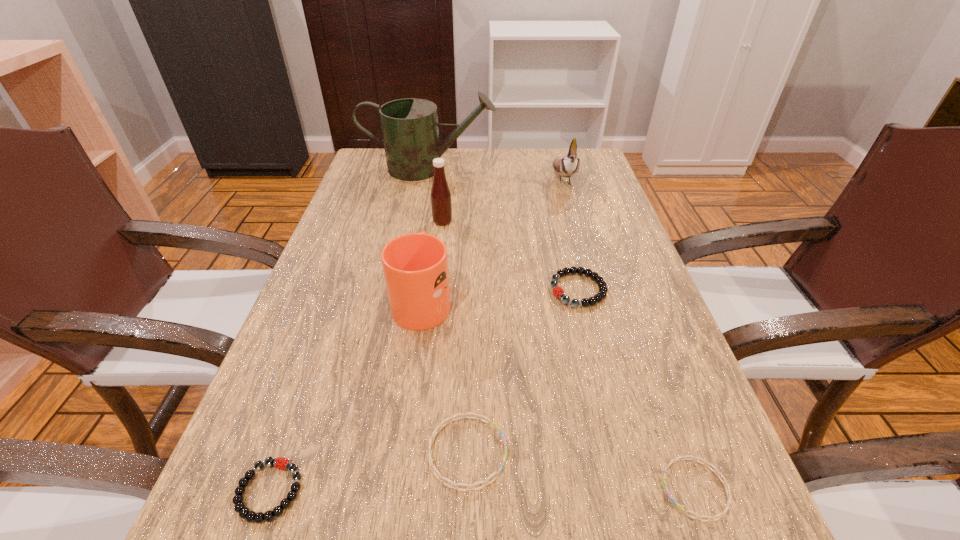
The height and width of the screenshot is (540, 960). In order to click on bracelet that is the third closest to the green watering can in this screenshot , I will do `click(244, 512)`.

Identify the location of vacant space that satisfies the following two spatial constraints: 1. on the handle side of the right black bracelet; 2. on the left side of the orange mug. (423, 290).

You are a GUI agent. You are given a task and a screenshot of the screen. Output one action in this format:
    pyautogui.click(x=<x>, y=<y>)
    Task: Click on the vacant space that satisfies the following two spatial constraints: 1. on the surface of the left blue bracelet showing star-shaped elements; 2. on the front side of the smaller black bracelet
    
    Given the screenshot: What is the action you would take?
    pyautogui.click(x=467, y=491)